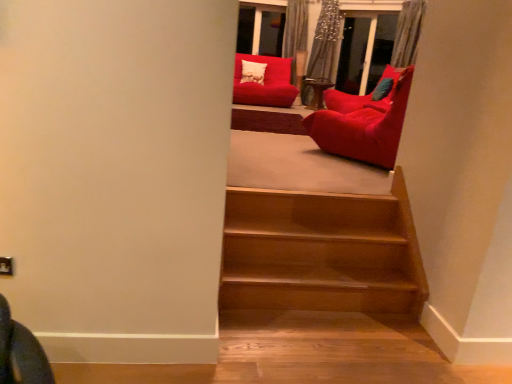
Question: Which is correct: matte red beanbag at upper center, the 2th chair viewed from the right, is inside velvet red bean bag at upper right, arranged as the second chair when viewed from the top, or outside of it?

Choices:
 (A) outside
 (B) inside

Answer: (A)

Question: Based on their sizes in the image, would you say matte red beanbag at upper center, which is the 2th chair in bottom-to-top order, is bigger or smaller than velvet red bean bag at upper right, arranged as the second chair when viewed from the top?

Choices:
 (A) big
 (B) small

Answer: (A)

Question: In terms of height, does matte red beanbag at upper center, marked as the 1th chair in a left-to-right arrangement, look taller or shorter compared to velvet red bean bag at upper right, which is the 1th chair from front to back?

Choices:
 (A) tall
 (B) short

Answer: (B)

Question: In terms of height, does velvet red bean bag at upper right, which is counted as the second chair, starting from the back, look taller or shorter compared to matte red beanbag at upper center, the 1th chair when ordered from back to front?

Choices:
 (A) tall
 (B) short

Answer: (A)

Question: From a real-world perspective, relative to matte red beanbag at upper center, the first chair when ordered from top to bottom, is velvet red bean bag at upper right, arranged as the second chair when viewed from the top, vertically above or below?

Choices:
 (A) above
 (B) below

Answer: (A)

Question: From the image's perspective, is velvet red bean bag at upper right, arranged as the second chair when viewed from the top, positioned above or below matte red beanbag at upper center, which is the 2th chair in bottom-to-top order?

Choices:
 (A) below
 (B) above

Answer: (A)

Question: Is velvet red bean bag at upper right, positioned as the 1th chair in bottom-to-top order, in front of or behind matte red beanbag at upper center, the 2th chair viewed from the front, in the image?

Choices:
 (A) behind
 (B) front

Answer: (B)